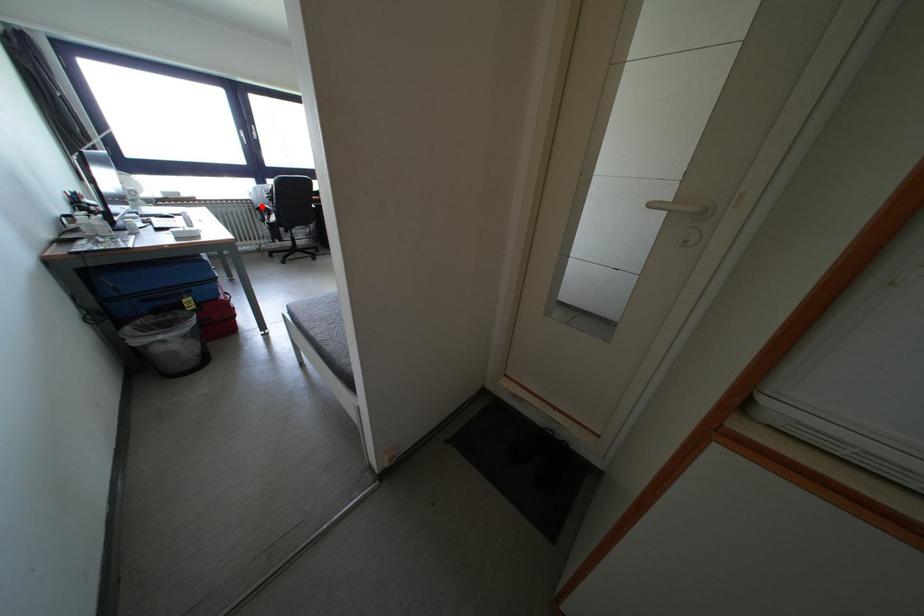
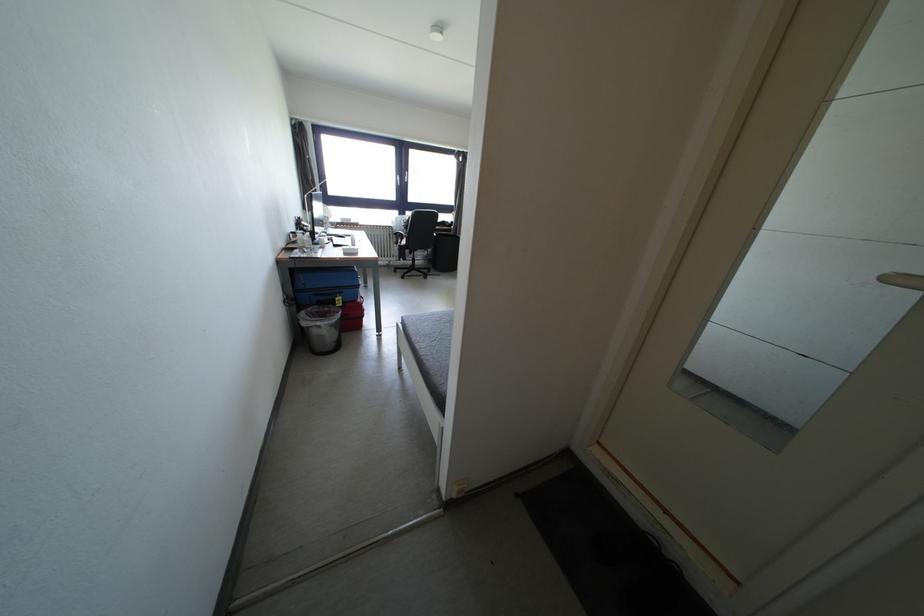
Find the pixel in the second image that matches the highlighted location in the first image.

(400, 233)